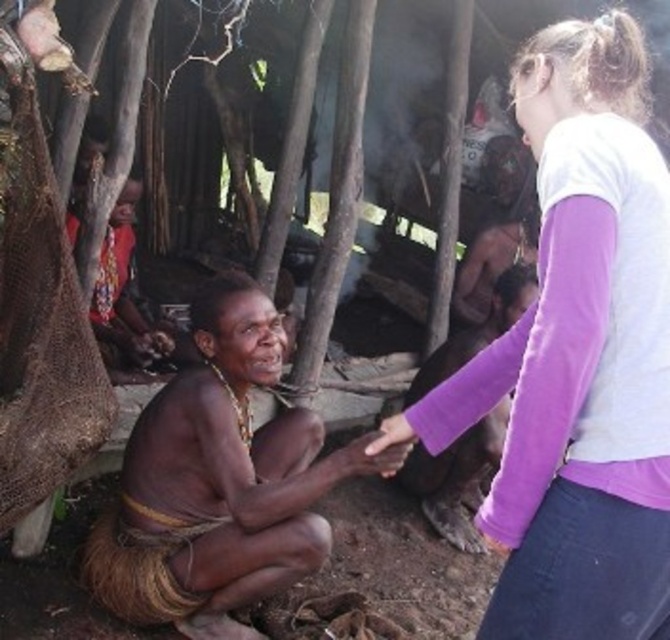
You are a traveler standing in front of the thatched roof hut. You see the white cotton shirt at upper right and the brown skin man at center. Which object is nearer to you?

The white cotton shirt at upper right is closer to the viewer than the brown skin man at center.

Where is the white cotton shirt at upper right located in the image?

The white cotton shirt at upper right is located at point coordinates of (578, 356).

You are a traveler who just arrived at this rural village and need to find a place to store your white cotton shirt. You remember seeing it at point (578, 356) in the image. Can you describe where exactly that location is in relation to the man and the woman?

The white cotton shirt at upper right is located at point (578, 356), which is at the upper right area of the image, near the thatched roof and above the man and woman.